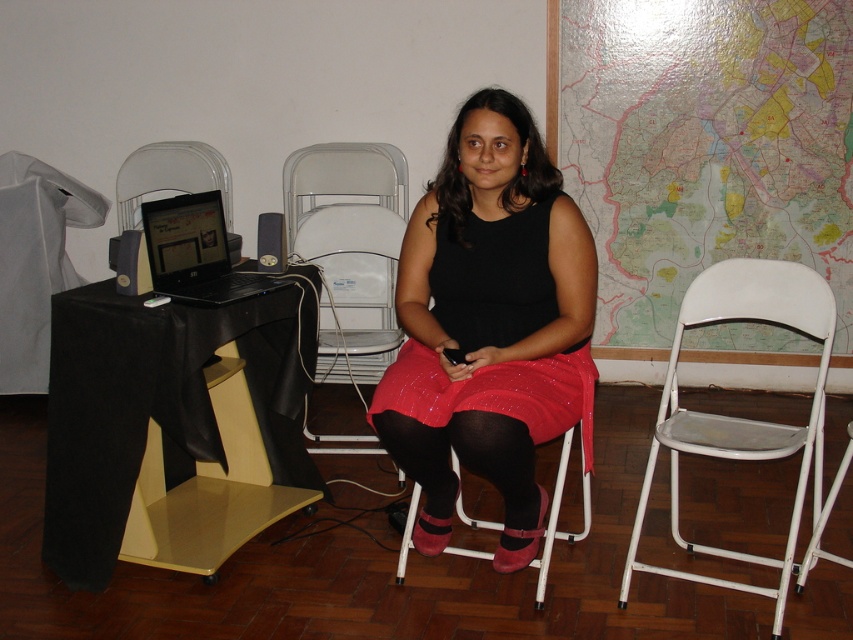
You are a fashion designer who needs to place a 30 cm wide dress mannequin between the matte black dress at center and the pink fabric stool at center. Is there enough space for the mannequin?

The matte black dress at center is 34.92 centimeters from the pink fabric stool at center. Since the mannequin is 30 cm wide, there is enough space to place it between them.

You are organizing a fashion show and need to place the matte black dress at center and the matte black laptop at left on a display table. Which object requires more space for proper display?

The matte black dress at center is bigger than the matte black laptop at left, so it requires more space for proper display.

You are trying to locate the matte black laptop at left in the image. According to the coordinates provided, where exactly is it positioned?

The matte black laptop at left is located at point coordinates (195,252).